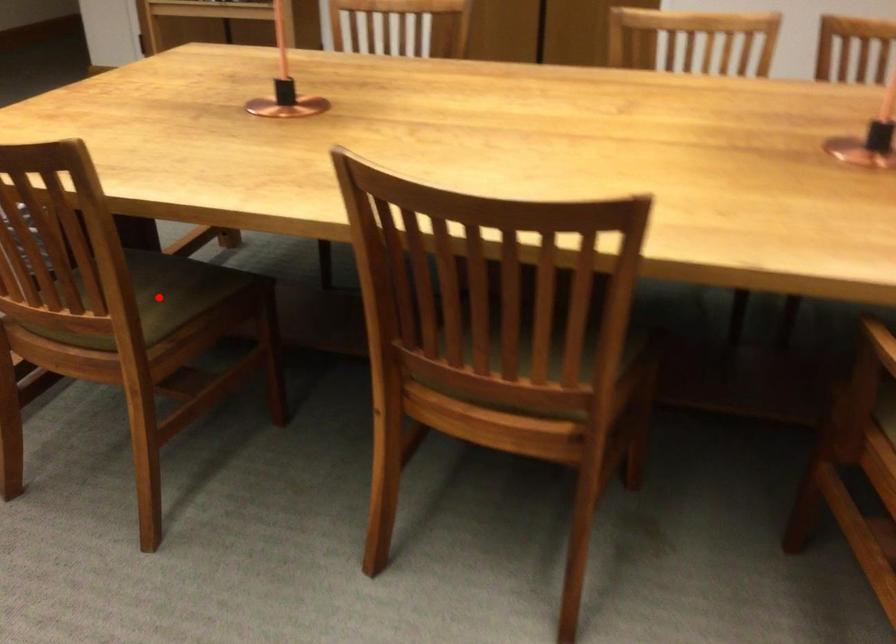
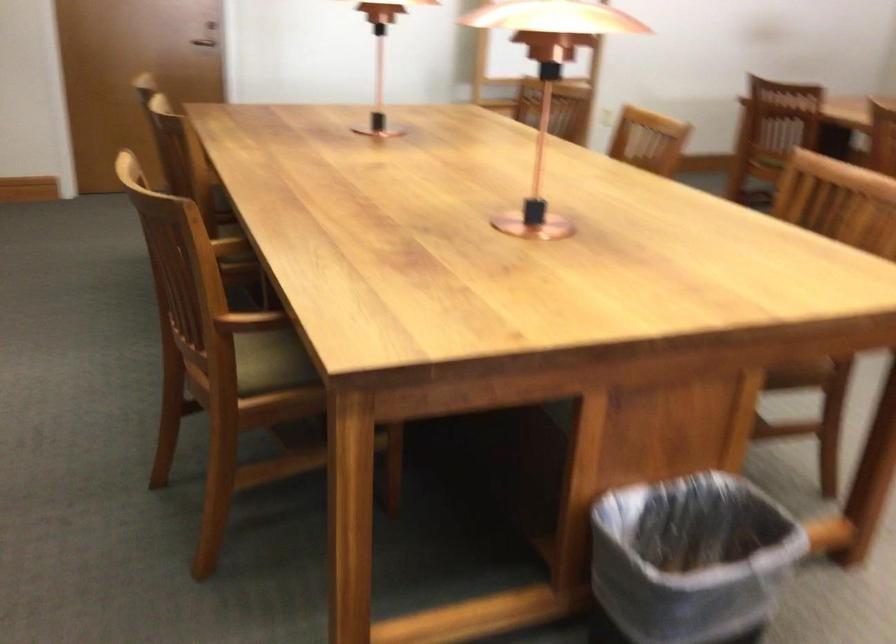
Question: I am providing you with two images of the same scene from different viewpoints. A red point is marked on the first image. Can you still see the location of the red point in image 2?

Choices:
 (A) Yes
 (B) No

Answer: (B)